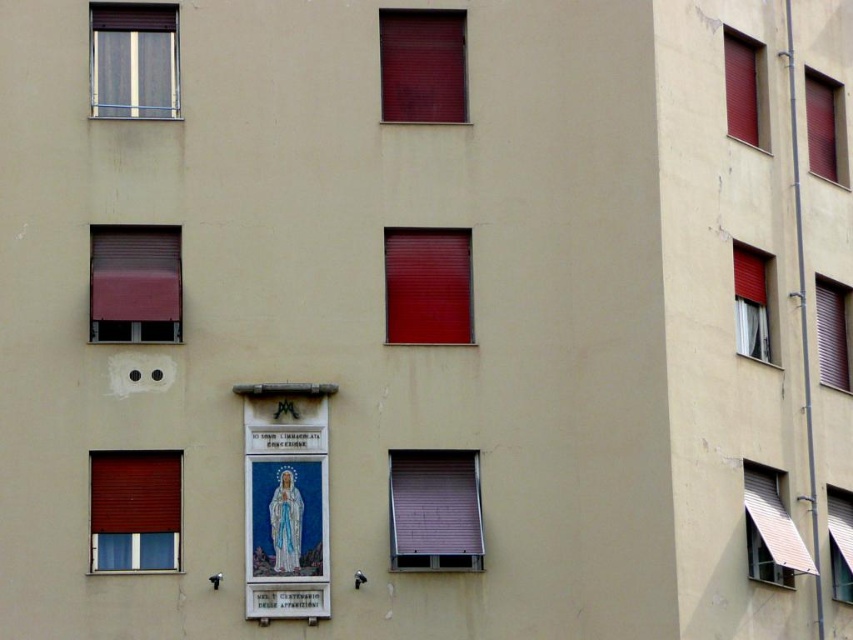
Looking at this image, can you confirm if matte red window at center is bigger than metallic silver window at right?

Indeed, matte red window at center has a larger size compared to metallic silver window at right.

Who is positioned more to the right, matte red window at center or metallic silver window at right?

From the viewer's perspective, metallic silver window at right appears more on the right side.

Image resolution: width=853 pixels, height=640 pixels. Describe the element at coordinates (427, 285) in the screenshot. I see `matte red window at center` at that location.

The height and width of the screenshot is (640, 853). Find the location of `matte red window at center`. matte red window at center is located at coordinates (427, 285).

Between matte red window at center and white sheer curtain at right, which one has less height?

matte red window at center

Between point (402, 337) and point (769, 256), which one is positioned in front?

Point (402, 337) is more forward.

Where is `matte red window at center`? Image resolution: width=853 pixels, height=640 pixels. matte red window at center is located at coordinates (427, 285).

Does matte red roller at upper center lie behind white sheer curtain at right?

No.

Between matte red roller at upper center and white sheer curtain at right, which one has more height?

With more height is white sheer curtain at right.

Find the location of a particular element. This screenshot has width=853, height=640. matte red roller at upper center is located at coordinates (422, 65).

Identify the location of matte red roller at upper center. The height and width of the screenshot is (640, 853). (422, 65).